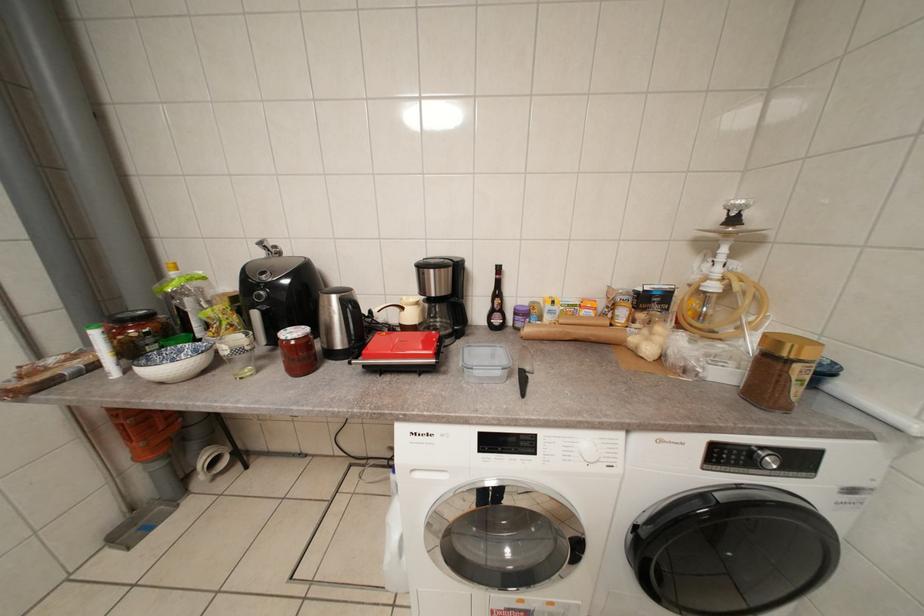
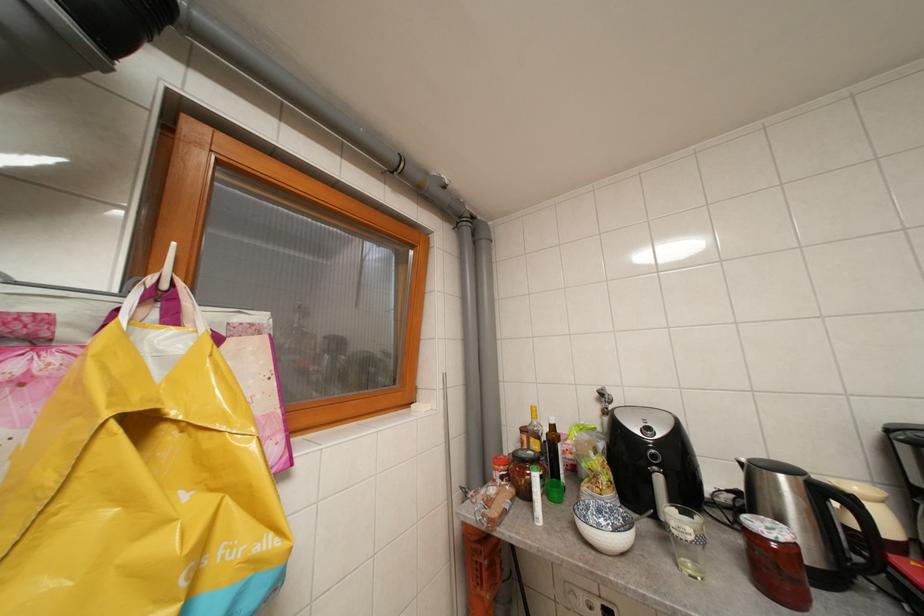
How did the camera likely rotate?

The rotation direction of the camera is left-up.